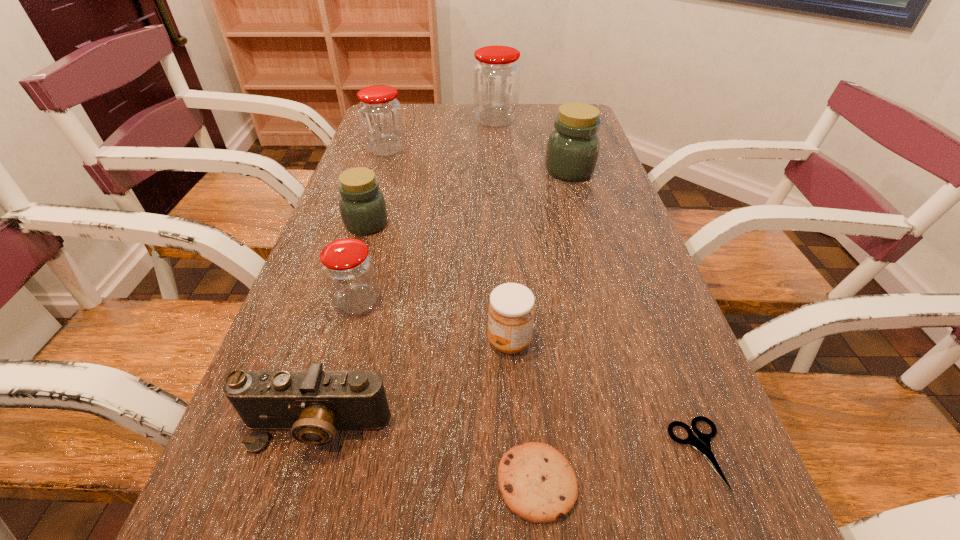
Locate an element on the screen. This screenshot has width=960, height=540. free spot at the right edge of the desktop is located at coordinates (637, 227).

In the image, there is a desktop. At what (x,y) coordinates should I click in order to perform the action: click on vacant space at the far right corner. Please return your answer as a coordinate pair (x, y). Looking at the image, I should click on (555, 120).

The width and height of the screenshot is (960, 540). Find the location of `vacant space that is in between the shortest object and the second shortest object`. vacant space that is in between the shortest object and the second shortest object is located at coordinates (618, 468).

What are the coordinates of `vacant area between the shortest object and the tallest jar` in the screenshot? It's located at (597, 287).

You are a GUI agent. You are given a task and a screenshot of the screen. Output one action in this format:
    pyautogui.click(x=<x>, y=<y>)
    Task: Click on the empty location between the orange jam and the rightmost jar
    Image resolution: width=960 pixels, height=540 pixels.
    Given the screenshot: What is the action you would take?
    pyautogui.click(x=540, y=256)

Where is `free space between the second jar from right to left and the nearest jar`? free space between the second jar from right to left and the nearest jar is located at coordinates (426, 212).

At what (x,y) coordinates should I click in order to perform the action: click on empty space that is in between the rightmost jar and the cookie. Please return your answer as a coordinate pair (x, y). This screenshot has width=960, height=540. Looking at the image, I should click on (553, 327).

At what (x,y) coordinates should I click in order to perform the action: click on free space between the jam and the shears. Please return your answer as a coordinate pair (x, y). The image size is (960, 540). Looking at the image, I should click on (604, 397).

In order to click on vacant area that lies between the farther green jar and the second smallest red jar in this screenshot , I will do `click(477, 160)`.

Image resolution: width=960 pixels, height=540 pixels. What are the coordinates of `vacant area between the rightmost jar and the fifth nearest object` in the screenshot? It's located at (464, 237).